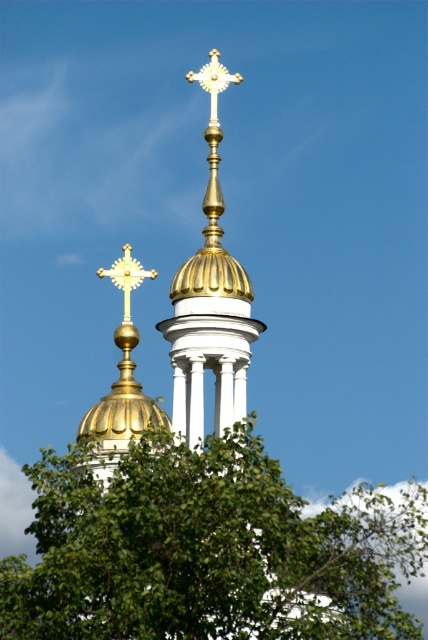
You are standing in front of the building and notice a green leafy tree at center and a gold polished metal cross at upper center. Which object is positioned to the left of the other?

The green leafy tree at center is to the left of the gold polished metal cross at upper center.

Based on the photo, you are an architect analyzing the building structure. You need to locate the gold metallic cross at upper center for structural assessment. What are its coordinates?

The gold metallic cross at upper center is located at coordinates point (125, 276).

You are an architect examining the church facade. You notice two gold crosses at the upper center. Which cross is positioned lower between the gold metallic cross at upper center and the gold polished metal cross at upper center?

The gold metallic cross at upper center is positioned lower than the gold polished metal cross at upper center.